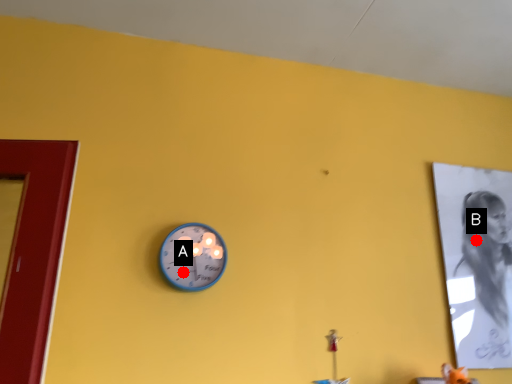
Question: Two points are circled on the image, labeled by A and B beside each circle. Which point is farther from the camera taking this photo?

Choices:
 (A) A is further
 (B) B is further

Answer: (B)